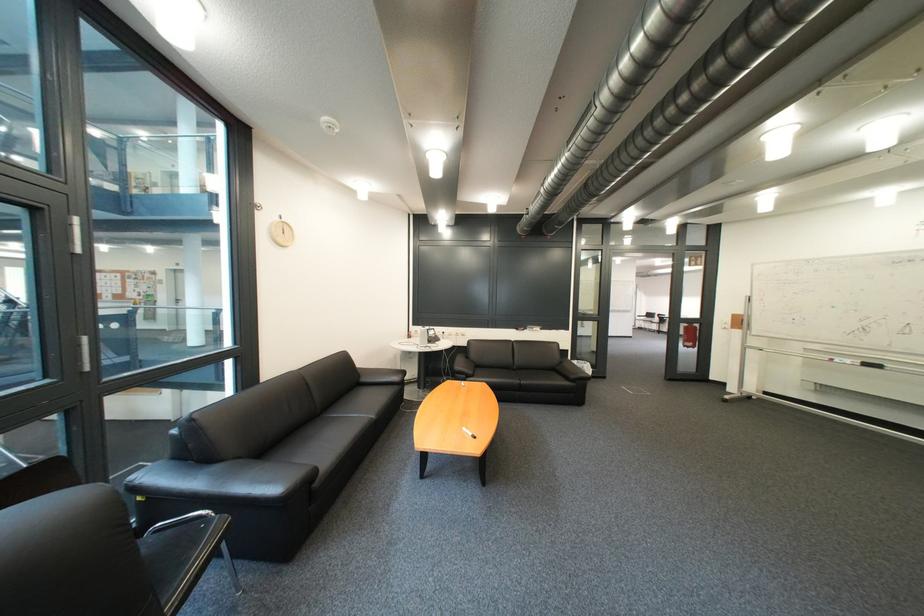
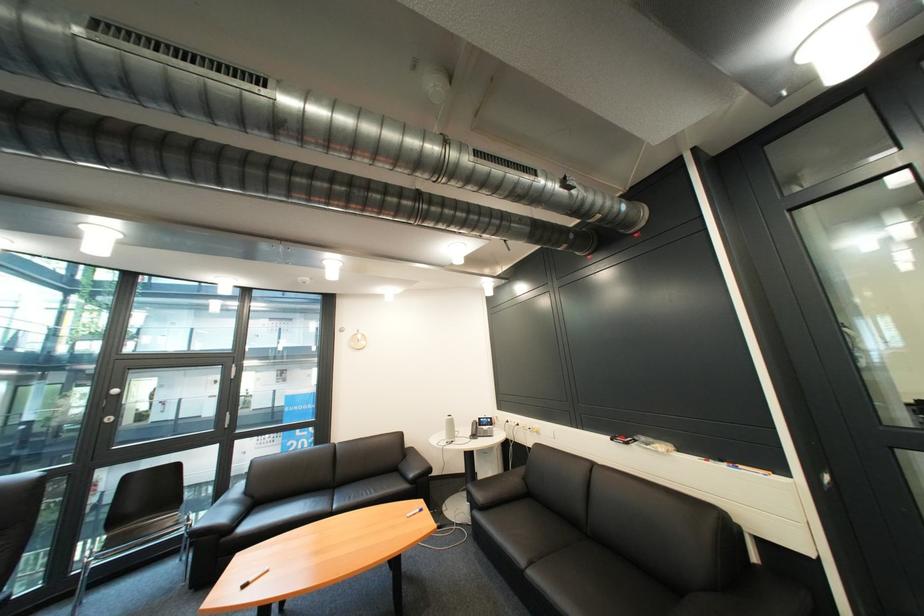
Where in the second image is the point corresponding to point (568, 333) from the first image?

(736, 468)